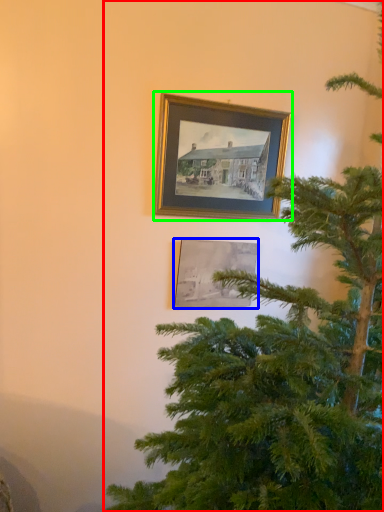
Question: Based on their relative distances, which object is nearer to christmas tree (highlighted by a red box)? Choose from picture frame (highlighted by a blue box) and picture frame (highlighted by a green box).

Choices:
 (A) picture frame
 (B) picture frame

Answer: (A)